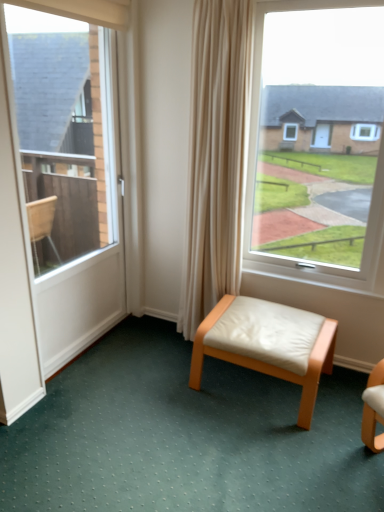
This screenshot has height=512, width=384. I want to click on vacant area that lies in front of white leather stool at center, so click(273, 452).